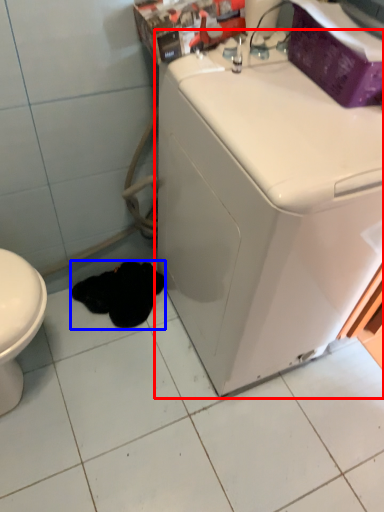
Question: Which object is closer to the camera taking this photo, washing machine (highlighted by a red box) or animal (highlighted by a blue box)?

Choices:
 (A) washing machine
 (B) animal

Answer: (A)